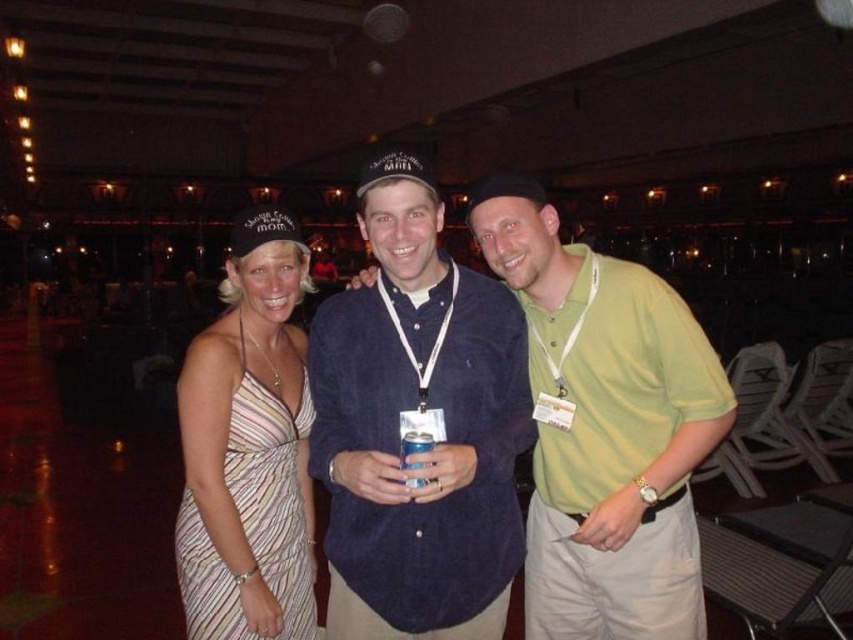
You are organizing a charity event and need to arrange these two outfits on a mannequin stand. The stand has a height limit of 60 cm. If the green cotton polo shirt at center is larger than the striped fabric dress at left, which outfit would you choose to display first to ensure it fits the stand?

The green cotton polo shirt at center is larger than the striped fabric dress at left, so you should display the striped fabric dress at left first since it is smaller and more likely to fit within the 60 cm height limit.

You are a photographer at a social event and need to capture a group photo of the striped fabric dress at center and blue corduroy shirt at center. The camera you are using has a minimum focus distance of 3 inches. Will you be able to focus on both subjects simultaneously?

The distance between the striped fabric dress at center and the blue corduroy shirt at center is 2.93 inches, which is less than the camera minimum focus distance of 3 inches. Therefore, the camera cannot focus on both subjects simultaneously.